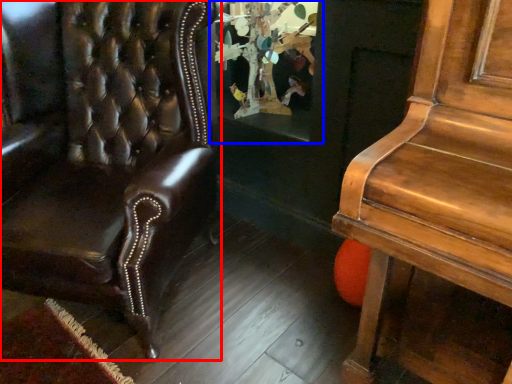
Question: Among these objects, which one is farthest to the camera, chair (highlighted by a red box) or shop window (highlighted by a blue box)?

Choices:
 (A) chair
 (B) shop window

Answer: (B)